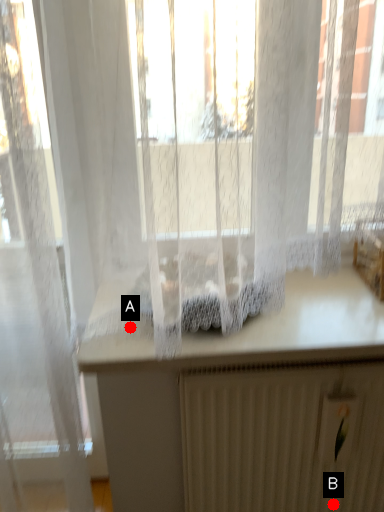
Question: Two points are circled on the image, labeled by A and B beside each circle. Which point is farther from the camera taking this photo?

Choices:
 (A) A is further
 (B) B is further

Answer: (B)